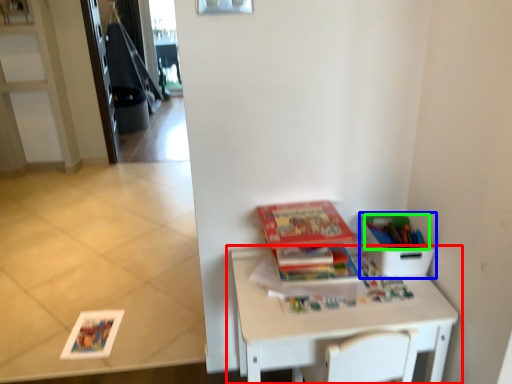
Question: Which object is the farthest from table (highlighted by a red box)? Choose among these: cardboard box (highlighted by a blue box) or book (highlighted by a green box).

Choices:
 (A) cardboard box
 (B) book

Answer: (B)